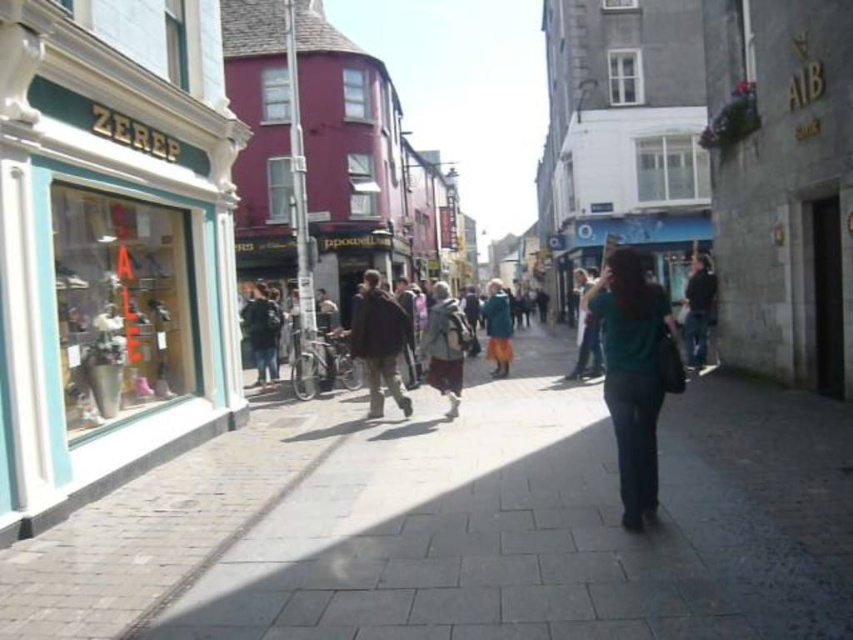
Question: Estimate the real-world distances between objects in this image. Which object is closer to the teal fabric shirt at center?

Choices:
 (A) matte teal storefront at left
 (B) brick pavement at center

Answer: (B)

Question: Is brick pavement at center bigger than matte teal storefront at left?

Choices:
 (A) no
 (B) yes

Answer: (B)

Question: Is brick pavement at center below teal fabric shirt at center?

Choices:
 (A) yes
 (B) no

Answer: (A)

Question: Is brick pavement at center to the left of teal fabric shirt at center from the viewer's perspective?

Choices:
 (A) yes
 (B) no

Answer: (A)

Question: Which object is the closest to the matte teal storefront at left?

Choices:
 (A) brick pavement at center
 (B) teal fabric shirt at center

Answer: (A)

Question: Which of the following is the farthest from the observer?

Choices:
 (A) teal fabric shirt at center
 (B) matte teal storefront at left

Answer: (B)